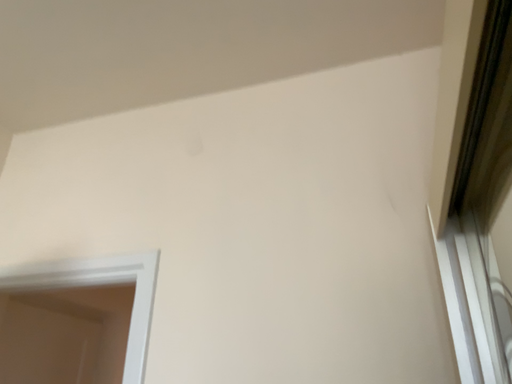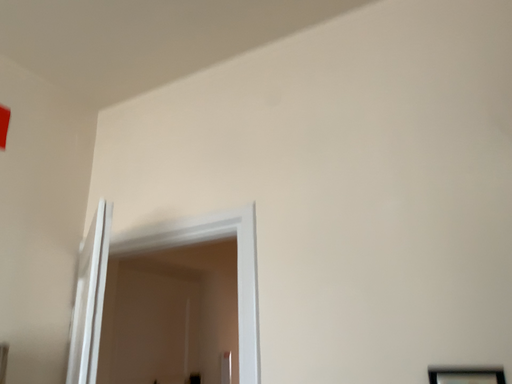
Question: How did the camera likely rotate when shooting the video?

Choices:
 (A) rotated right
 (B) rotated left

Answer: (B)